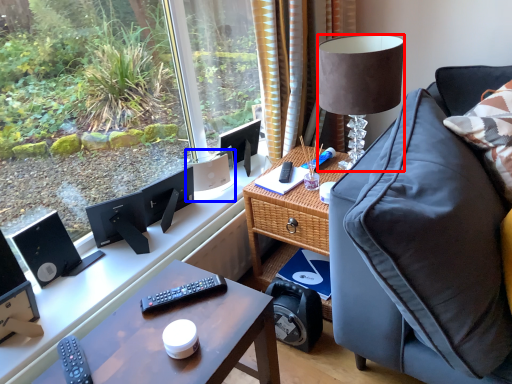
Question: Which of the following is the closest to the observer, lamp (highlighted by a red box) or speaker (highlighted by a blue box)?

Choices:
 (A) lamp
 (B) speaker

Answer: (A)